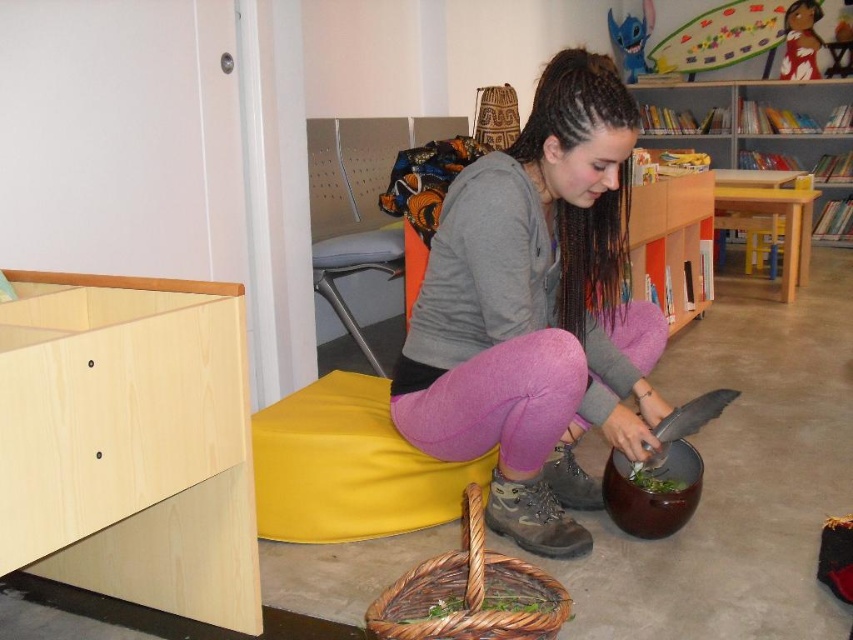
Question: Which of the following is the closest to the observer?

Choices:
 (A) (637, 93)
 (B) (625, 147)
 (C) (374, 371)

Answer: (B)

Question: Can you confirm if brown leather shoe at lower center is thinner than smooth plastic doll at upper right?

Choices:
 (A) no
 (B) yes

Answer: (A)

Question: Which object is farther from the camera taking this photo?

Choices:
 (A) matte gray hoodie at center
 (B) blue plush toy at upper center
 (C) metallic gray stool at center

Answer: (B)

Question: Is metallic gray stool at center above leather at lower center?

Choices:
 (A) no
 (B) yes

Answer: (B)

Question: Which point appears closest to the camera in this image?

Choices:
 (A) (489, 528)
 (B) (506, 326)
 (C) (809, 28)

Answer: (B)

Question: Can you confirm if matte gray hoodie at center is thinner than leather at lower center?

Choices:
 (A) yes
 (B) no

Answer: (B)